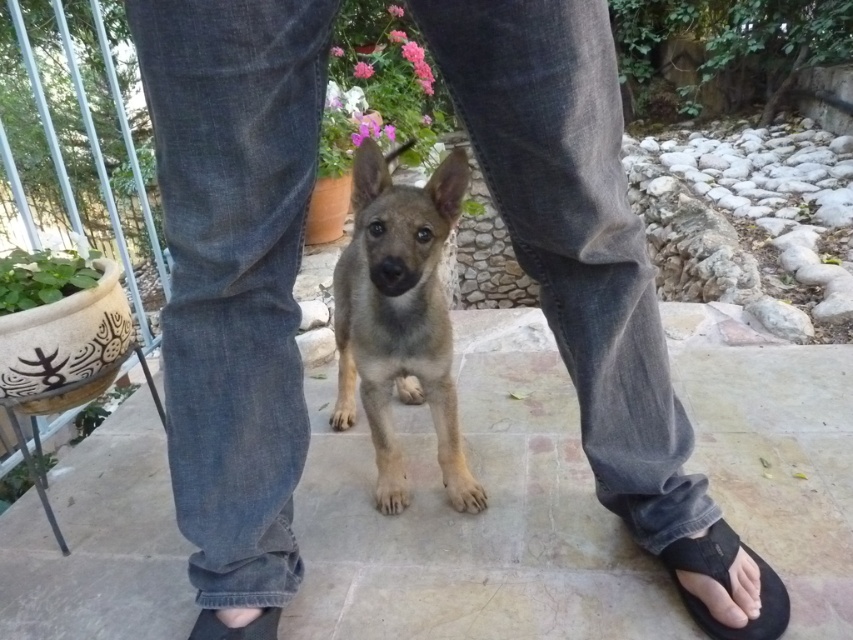
Does fuzzy brown puppy at center have a greater height compared to black rubber sandal at lower right?

Correct, fuzzy brown puppy at center is much taller as black rubber sandal at lower right.

Locate an element on the screen. This screenshot has height=640, width=853. fuzzy brown puppy at center is located at coordinates (399, 317).

Is point (480, 493) behind point (786, 602)?

Yes, point (480, 493) is farther from viewer.

Identify the location of fuzzy brown puppy at center. Image resolution: width=853 pixels, height=640 pixels. (399, 317).

Is black rubber sandal at lower right below black rubber sandal at lower center?

No.

Is point (712, 534) positioned in front of point (271, 618)?

No, it is not.

Find the location of `black rubber sandal at lower right`. black rubber sandal at lower right is located at coordinates (726, 582).

Which is above, fuzzy brown puppy at center or black rubber sandal at lower center?

fuzzy brown puppy at center is higher up.

Between fuzzy brown puppy at center and black rubber sandal at lower center, which one is positioned lower?

black rubber sandal at lower center

Is point (354, 305) positioned after point (254, 637)?

Yes, it is.

The height and width of the screenshot is (640, 853). What are the coordinates of `fuzzy brown puppy at center` in the screenshot? It's located at (399, 317).